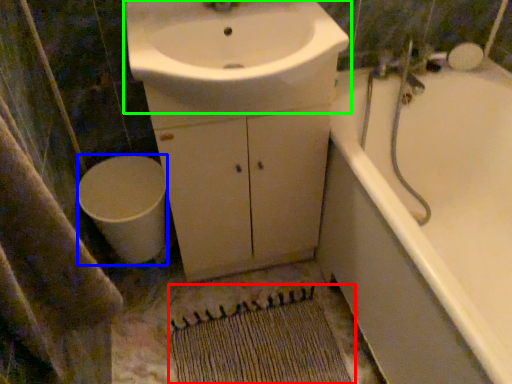
Question: Which is nearer to the doormat (highlighted by a red box)? toilet (highlighted by a blue box) or sink (highlighted by a green box).

Choices:
 (A) toilet
 (B) sink

Answer: (A)